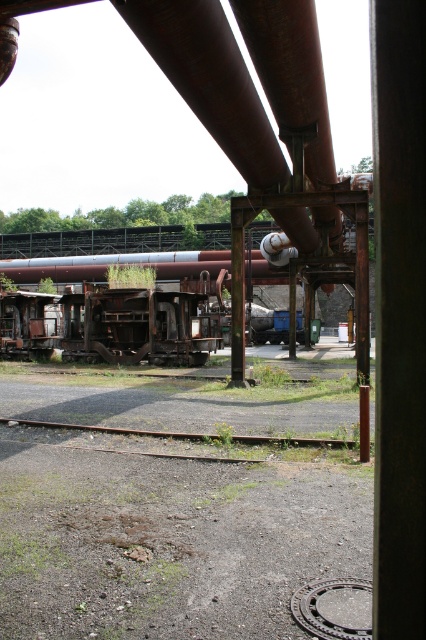
Question: Which point appears farthest from the camera in this image?

Choices:
 (A) (134, 432)
 (B) (184, 355)

Answer: (B)

Question: Among these points, which one is nearest to the camera?

Choices:
 (A) (132, 326)
 (B) (298, 442)
 (C) (391, 225)

Answer: (C)

Question: Which point is farther from the camera taking this photo?

Choices:
 (A) (89, 294)
 (B) (196, 435)
 (C) (391, 316)

Answer: (A)

Question: Observing the image, what is the correct spatial positioning of rusty metal train car at center in reference to rusty metal train track at lower center?

Choices:
 (A) above
 (B) below

Answer: (A)

Question: Can you confirm if rusty metal pole at center is smaller than rusty metal train track at lower center?

Choices:
 (A) yes
 (B) no

Answer: (A)

Question: Is rusty metal pole at center below rusty metal train track at lower center?

Choices:
 (A) yes
 (B) no

Answer: (B)